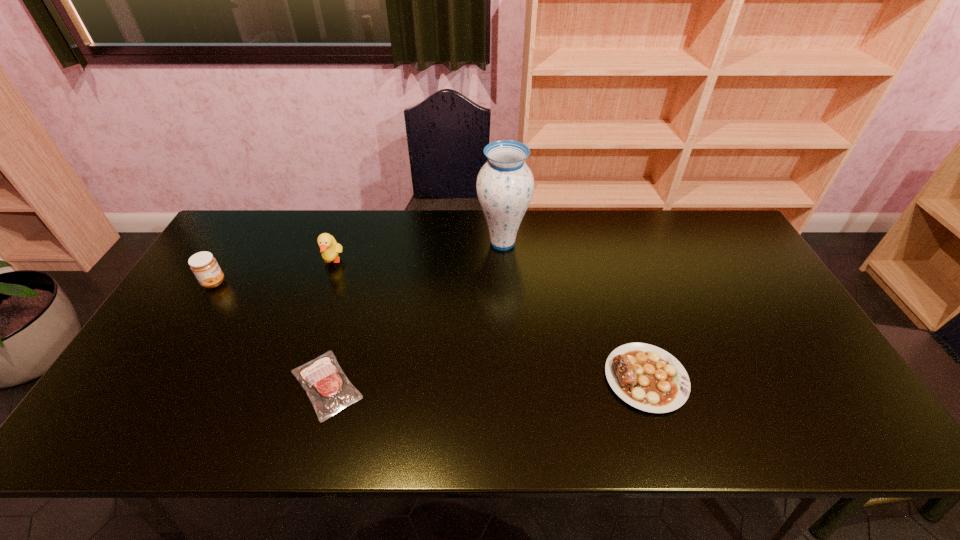
At what (x,y) coordinates should I click in order to perform the action: click on free spot between the duckling and the vase. Please return your answer as a coordinate pair (x, y). The image size is (960, 540). Looking at the image, I should click on [x=418, y=252].

Identify the location of vacant region between the leftmost object and the rightmost object. (430, 330).

Locate which object ranks in proximity to the third farthest object. Please provide its 2D coordinates. Your answer should be formatted as a tuple, i.e. [(x, y)], where the tuple contains the x and y coordinates of a point satisfying the conditions above.

[(329, 248)]

The height and width of the screenshot is (540, 960). I want to click on object that is the second nearest to the duckling, so (x=328, y=388).

You are a GUI agent. You are given a task and a screenshot of the screen. Output one action in this format:
    pyautogui.click(x=<x>, y=<y>)
    Task: Click on the free region that satisfies the following two spatial constraints: 1. on the front-facing side of the duckling; 2. on the front label of the jam
    
    Given the screenshot: What is the action you would take?
    pyautogui.click(x=325, y=282)

Find the location of a particular element. The height and width of the screenshot is (540, 960). vacant space that satisfies the following two spatial constraints: 1. on the front label of the right steak; 2. on the right side of the leftmost object is located at coordinates (156, 378).

The height and width of the screenshot is (540, 960). Find the location of `free spot that satisfies the following two spatial constraints: 1. on the front-facing side of the duckling; 2. on the front label of the third farthest object`. free spot that satisfies the following two spatial constraints: 1. on the front-facing side of the duckling; 2. on the front label of the third farthest object is located at coordinates pyautogui.click(x=325, y=282).

The height and width of the screenshot is (540, 960). I want to click on vacant area in the image that satisfies the following two spatial constraints: 1. on the front-facing side of the duckling; 2. on the front label of the jam, so point(325,282).

Find the location of a particular element. This screenshot has width=960, height=540. vacant space that satisfies the following two spatial constraints: 1. on the back side of the shortest object; 2. on the left side of the right steak is located at coordinates (328, 378).

Identify the location of free location that satisfies the following two spatial constraints: 1. on the front side of the rightmost object; 2. on the left side of the tallest object. (511, 378).